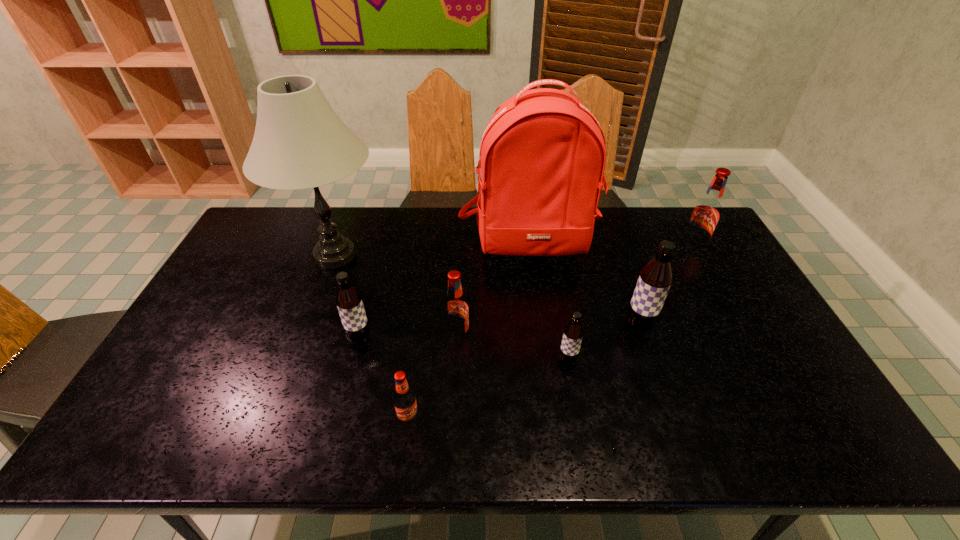
Locate an element on the screen. The height and width of the screenshot is (540, 960). the seventh farthest object is located at coordinates (573, 333).

This screenshot has width=960, height=540. In order to click on the fourth root beer from left to right in this screenshot , I will do `click(573, 333)`.

In order to click on the nearest red root beer in this screenshot , I will do `click(404, 398)`.

In order to click on the nearest root beer in this screenshot , I will do `click(404, 398)`.

The height and width of the screenshot is (540, 960). In order to click on vacant space situated on the front of the black lamp in this screenshot , I will do `click(312, 319)`.

This screenshot has height=540, width=960. I want to click on vacant region located 0.240m on the main compartment of the backpack, so click(x=542, y=333).

This screenshot has width=960, height=540. I want to click on blank space located on the front of the rightmost object, so click(x=709, y=278).

Where is `vacant space situated 0.160m on the left of the second root beer from right to left`? Image resolution: width=960 pixels, height=540 pixels. vacant space situated 0.160m on the left of the second root beer from right to left is located at coordinates (567, 327).

You are a GUI agent. You are given a task and a screenshot of the screen. Output one action in this format:
    pyautogui.click(x=<x>, y=<y>)
    Task: Click on the free location located 0.080m on the front of the third root beer from left to right
    
    Given the screenshot: What is the action you would take?
    pyautogui.click(x=456, y=372)

This screenshot has height=540, width=960. Identify the location of blank space located 0.250m on the front of the leftmost brown root beer. (335, 435).